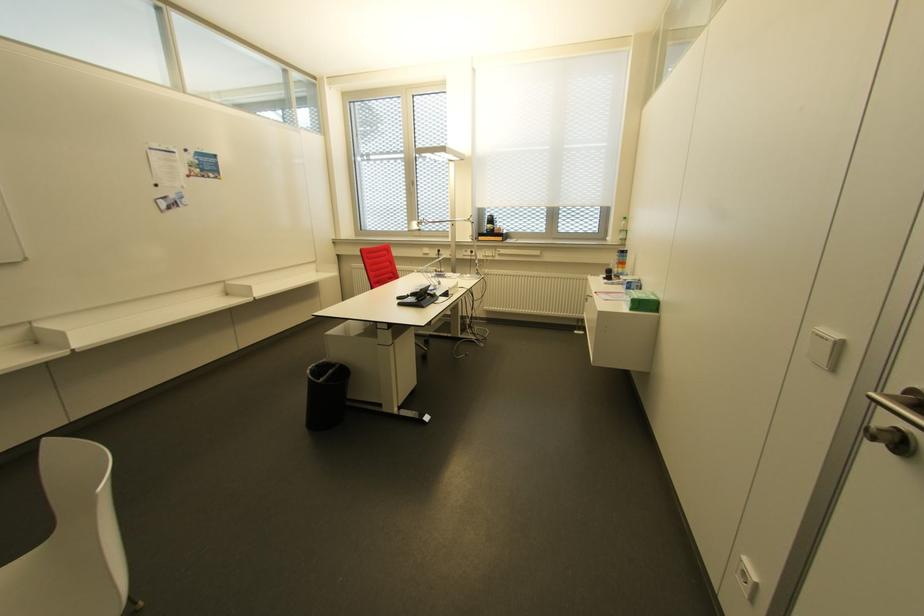
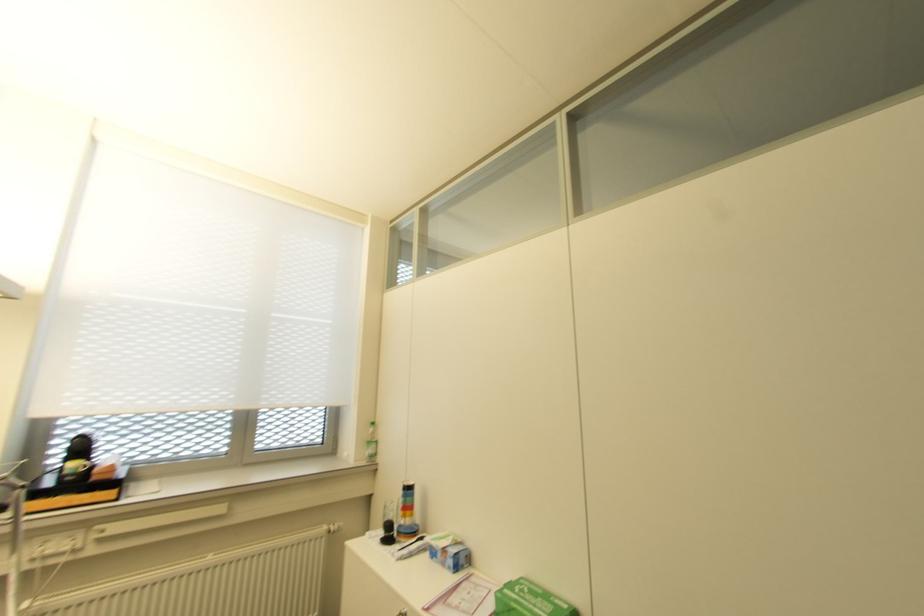
In the second image, find the point that corresponds to (650,298) in the first image.

(563, 605)